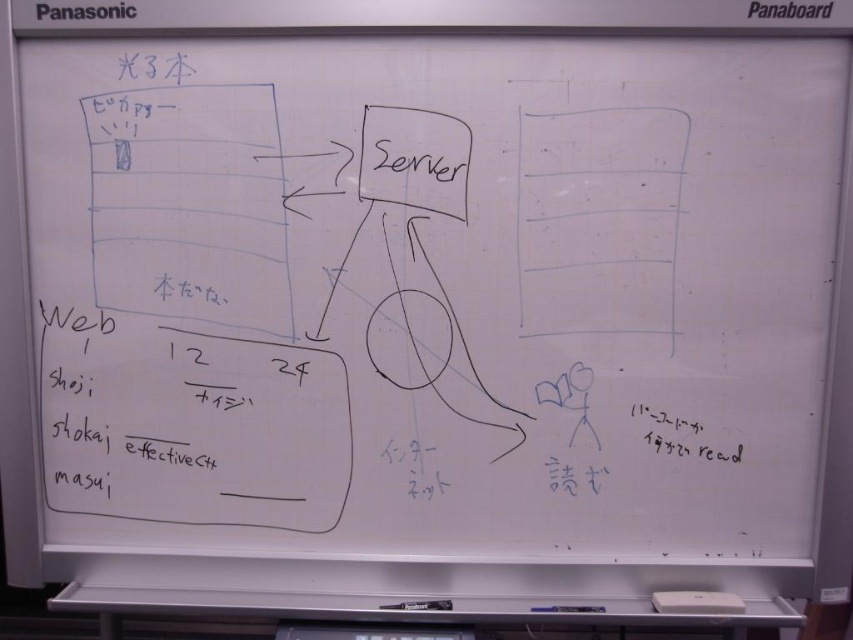
Between black paper at lower right and white matte eraser at bottom, which one is positioned higher?

black paper at lower right

Who is taller, black paper at lower right or white matte eraser at bottom?

Standing taller between the two is black paper at lower right.

Does point (665, 436) lie in front of point (720, 595)?

That is False.

You are a GUI agent. You are given a task and a screenshot of the screen. Output one action in this format:
    pyautogui.click(x=<x>, y=<y>)
    Task: Click on the black paper at lower right
    
    Given the screenshot: What is the action you would take?
    point(680,435)